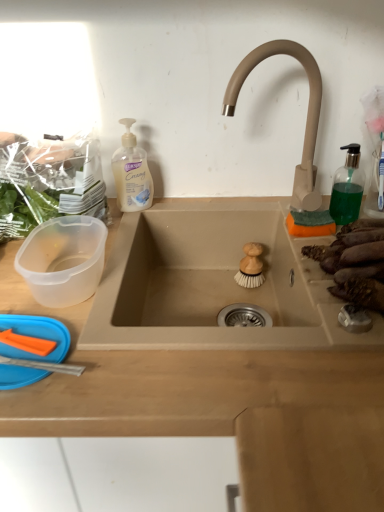
This screenshot has width=384, height=512. In order to click on free space to the left of green translucent soap dispenser at right in this screenshot , I will do `click(272, 217)`.